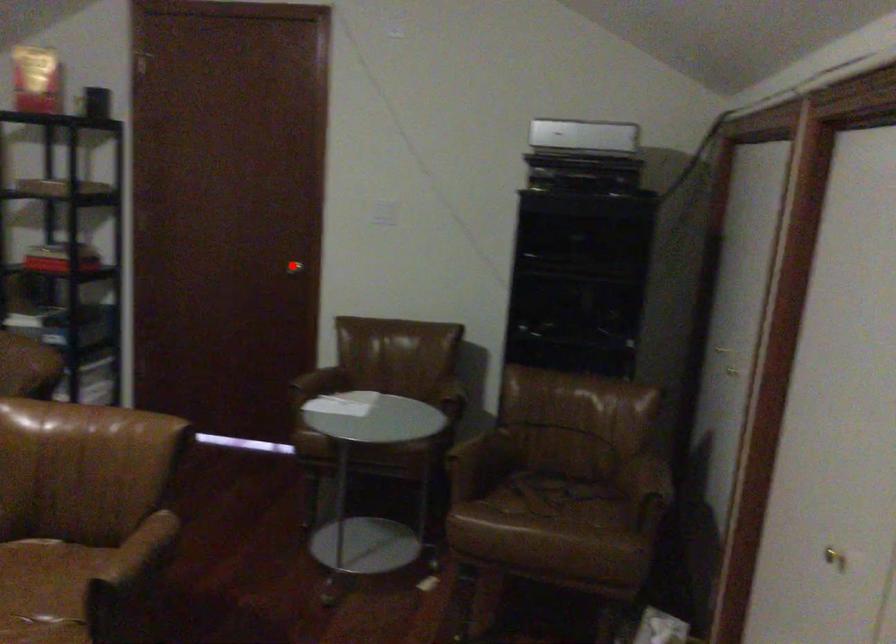
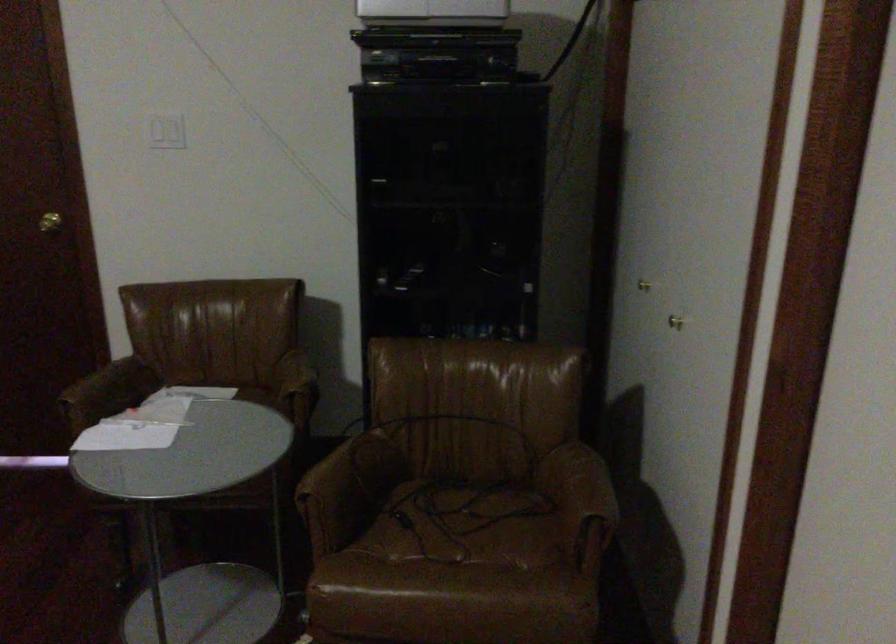
The point at the highlighted location is marked in the first image. Where is the corresponding point in the second image?

(49, 222)